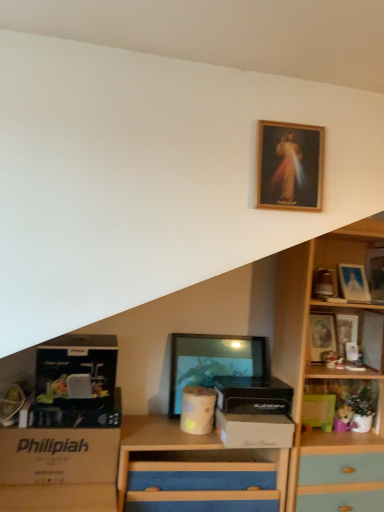
Question: Which direction should I rotate to look at matte black picture frame at center, positioned as the 3th picture frame in front-to-back order?

Choices:
 (A) left
 (B) right

Answer: (B)

Question: From a real-world perspective, does black plastic box at center, the second box in the top-to-bottom sequence, stand above wooden picture frame at upper center, which is the second picture frame from left to right?

Choices:
 (A) no
 (B) yes

Answer: (A)

Question: Is black plastic box at center, placed as the 2th box when sorted from bottom to top, not within wooden picture frame at upper center, the 5th picture frame from the right?

Choices:
 (A) yes
 (B) no

Answer: (A)

Question: Considering the relative positions of black plastic box at center, which is the second box from right to left, and wooden picture frame at upper center, the 5th picture frame from the right, in the image provided, is black plastic box at center, which is the second box from right to left, to the right of wooden picture frame at upper center, the 5th picture frame from the right, from the viewer's perspective?

Choices:
 (A) no
 (B) yes

Answer: (A)

Question: Does black plastic box at center, the second box in the top-to-bottom sequence, turn towards wooden picture frame at upper center, which is the second picture frame from left to right?

Choices:
 (A) yes
 (B) no

Answer: (B)

Question: Is the depth of black plastic box at center, marked as the 2th box in a left-to-right arrangement, less than that of wooden picture frame at upper center, the 5th picture frame from the right?

Choices:
 (A) no
 (B) yes

Answer: (A)

Question: Can you confirm if black plastic box at center, the second box in the top-to-bottom sequence, is bigger than wooden picture frame at upper center, the 6th picture frame positioned from the back?

Choices:
 (A) no
 (B) yes

Answer: (B)

Question: Considering the relative sizes of white cardboard box at lower left, which is the second storage box from right to left, and white cardboard box at center, marked as the 2th storage box in a left-to-right arrangement, in the image provided, is white cardboard box at lower left, which is the second storage box from right to left, smaller than white cardboard box at center, marked as the 2th storage box in a left-to-right arrangement,?

Choices:
 (A) yes
 (B) no

Answer: (B)

Question: Are white cardboard box at lower left, which is the second storage box from right to left, and white cardboard box at center, marked as the 2th storage box in a left-to-right arrangement, far apart?

Choices:
 (A) no
 (B) yes

Answer: (A)

Question: From the image's perspective, is white cardboard box at lower left, which is the second storage box from right to left, on top of white cardboard box at center, marked as the 2th storage box in a left-to-right arrangement?

Choices:
 (A) yes
 (B) no

Answer: (B)

Question: From the image's perspective, is white cardboard box at lower left, arranged as the first storage box when viewed from the left, under white cardboard box at center, marked as the 2th storage box in a left-to-right arrangement?

Choices:
 (A) yes
 (B) no

Answer: (A)

Question: Does white cardboard box at lower left, arranged as the first storage box when viewed from the left, have a lesser height compared to white cardboard box at center, marked as the 2th storage box in a left-to-right arrangement?

Choices:
 (A) no
 (B) yes

Answer: (A)

Question: Considering the relative sizes of white cardboard box at lower left, which is the second storage box from right to left, and white cardboard box at center, the 1th storage box when ordered from right to left, in the image provided, is white cardboard box at lower left, which is the second storage box from right to left, wider than white cardboard box at center, the 1th storage box when ordered from right to left,?

Choices:
 (A) yes
 (B) no

Answer: (B)

Question: Would you say matte silver picture frame at upper right, the second picture frame from the right, is outside green matte box at lower right, the 1th box in the right-to-left sequence?

Choices:
 (A) no
 (B) yes

Answer: (B)